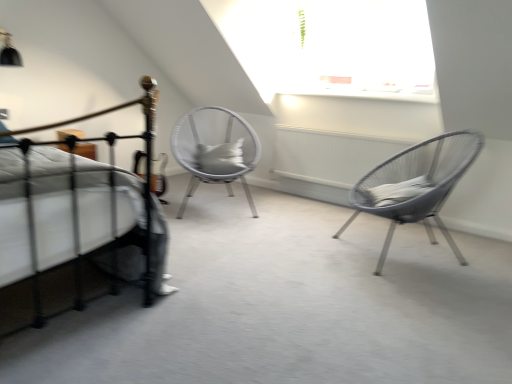
In order to face white woven chair at center, the 2th chair positioned from the right, should I rotate leftwards or rightwards?

To align with it, rotate left about 5.579°.

This screenshot has width=512, height=384. In order to click on gray fabric pillow at center in this screenshot , I will do `click(220, 158)`.

Find the location of a particular element. Image resolution: width=512 pixels, height=384 pixels. white woven chair at center, positioned as the first chair in left-to-right order is located at coordinates (213, 144).

Are black metal bed at left and gray fabric pillow at center making contact?

There is a gap between black metal bed at left and gray fabric pillow at center.

How distant is black metal bed at left from gray fabric pillow at center?

black metal bed at left is 1.47 meters away from gray fabric pillow at center.

Considering the positions of points (154, 223) and (232, 149), is point (154, 223) closer to camera compared to point (232, 149)?

Yes, point (154, 223) is closer to viewer.

Is gray fabric pillow at center not within white woven chair at center, acting as the 2th chair starting from the front?

No, gray fabric pillow at center is inside white woven chair at center, acting as the 2th chair starting from the front,'s boundary.

In the scene shown: Is the depth of gray fabric pillow at center greater than that of white woven chair at center, positioned as the first chair in left-to-right order?

That is True.

From a real-world perspective, which is physically above, gray fabric pillow at center or white woven chair at center, positioned as the first chair in left-to-right order?

From a 3D spatial view, gray fabric pillow at center is above.

Find the location of a particular element. This screenshot has width=512, height=384. pillow on the right of white woven chair at center, the 2th chair positioned from the right is located at coordinates (220, 158).

This screenshot has height=384, width=512. Identify the location of the 2nd chair counting from the right of the black metal bed at left. (416, 186).

Would you say metallic wire chair at right, the first chair in the front-to-back sequence, contains black metal bed at left?

No.

Is point (390, 162) positioned after point (75, 188)?

Yes, it is behind point (75, 188).

From the image's perspective, which object appears higher, metallic wire chair at right, the 2th chair in the back-to-front sequence, or black metal bed at left?

metallic wire chair at right, the 2th chair in the back-to-front sequence, from the image's perspective.

How different are the orientations of white woven chair at center, acting as the 2th chair starting from the front, and black metal bed at left in degrees?

37.5 degrees.

Starting from the black metal bed at left, which chair is the 1st one to the right? Please provide its 2D coordinates.

[(213, 144)]

Which is more to the left, white woven chair at center, positioned as the first chair in left-to-right order, or black metal bed at left?

From the viewer's perspective, black metal bed at left appears more on the left side.

Could you tell me if white woven chair at center, the 2th chair positioned from the right, is turned towards black metal bed at left?

No, white woven chair at center, the 2th chair positioned from the right, does not turn towards black metal bed at left.

Which object is wider, gray fabric pillow at center or black metal bed at left?

With larger width is black metal bed at left.

Which is correct: gray fabric pillow at center is inside black metal bed at left, or outside of it?

gray fabric pillow at center is outside black metal bed at left.

Which is nearer, (206,158) or (174,288)?

The point (174,288) is closer to the camera.

Who is smaller, white woven chair at center, acting as the 2th chair starting from the front, or gray fabric pillow at center?

gray fabric pillow at center is smaller.

Is white woven chair at center, positioned as the first chair in left-to-right order, aimed at gray fabric pillow at center?

Yes.

Is white woven chair at center, acting as the 2th chair starting from the front, inside or outside of gray fabric pillow at center?

white woven chair at center, acting as the 2th chair starting from the front, cannot be found inside gray fabric pillow at center.

In the scene shown: Looking at their sizes, would you say white woven chair at center, the 2th chair positioned from the right, is wider or thinner than gray fabric pillow at center?

In the image, white woven chair at center, the 2th chair positioned from the right, appears to be wider than gray fabric pillow at center.

Can you confirm if black metal bed at left is bigger than white woven chair at center, positioned as the first chair in left-to-right order?

Correct, black metal bed at left is larger in size than white woven chair at center, positioned as the first chair in left-to-right order.

Is black metal bed at left in front of or behind white woven chair at center, the first chair from the back, in the image?

black metal bed at left is positioned closer to the viewer than white woven chair at center, the first chair from the back.

How far apart are black metal bed at left and white woven chair at center, the 2th chair positioned from the right?

black metal bed at left and white woven chair at center, the 2th chair positioned from the right, are 5.02 feet apart.

From the image's perspective, is black metal bed at left under white woven chair at center, the 2th chair positioned from the right?

Yes.

Find the location of `bed lying below the gray fabric pillow at center (from the image's perspective)`. bed lying below the gray fabric pillow at center (from the image's perspective) is located at coordinates (78, 208).

The width and height of the screenshot is (512, 384). Identify the location of pillow lying above the white woven chair at center, the 2th chair positioned from the right (from the image's perspective). (220, 158).

Which object lies further to the anchor point black metal bed at left, white woven chair at center, acting as the 2th chair starting from the front, or metallic wire chair at right, the 2th chair in the back-to-front sequence?

The object further to black metal bed at left is metallic wire chair at right, the 2th chair in the back-to-front sequence.

Considering their positions, is black metal bed at left positioned further to gray fabric pillow at center than white woven chair at center, the 2th chair positioned from the right?

black metal bed at left is further to gray fabric pillow at center.

Considering their positions, is black metal bed at left positioned closer to metallic wire chair at right, the 2th chair in the back-to-front sequence, than white woven chair at center, the first chair from the back?

Based on the image, white woven chair at center, the first chair from the back, appears to be nearer to metallic wire chair at right, the 2th chair in the back-to-front sequence.

Based on their spatial positions, is white woven chair at center, the 2th chair positioned from the right, or black metal bed at left closer to gray fabric pillow at center?

white woven chair at center, the 2th chair positioned from the right, is positioned closer to the anchor gray fabric pillow at center.

When comparing their distances from metallic wire chair at right, arranged as the first chair when viewed from the right, does white woven chair at center, the first chair from the back, or black metal bed at left seem closer?

white woven chair at center, the first chair from the back, lies closer to metallic wire chair at right, arranged as the first chair when viewed from the right, than the other object.

When comparing their distances from white woven chair at center, positioned as the first chair in left-to-right order, does gray fabric pillow at center or black metal bed at left seem closer?

gray fabric pillow at center lies closer to white woven chair at center, positioned as the first chair in left-to-right order, than the other object.

Based on their spatial positions, is metallic wire chair at right, arranged as the first chair when viewed from the right, or white woven chair at center, positioned as the first chair in left-to-right order, closer to black metal bed at left?

white woven chair at center, positioned as the first chair in left-to-right order, lies closer to black metal bed at left than the other object.

From the image, which object appears to be farther from metallic wire chair at right, which is counted as the second chair, starting from the left, white woven chair at center, positioned as the first chair in left-to-right order, or gray fabric pillow at center?

white woven chair at center, positioned as the first chair in left-to-right order, is positioned further to the anchor metallic wire chair at right, which is counted as the second chair, starting from the left.

The image size is (512, 384). I want to click on pillow between black metal bed at left and metallic wire chair at right, the 2th chair in the back-to-front sequence, so click(220, 158).

Where is `pillow situated between white woven chair at center, positioned as the first chair in left-to-right order, and metallic wire chair at right, arranged as the first chair when viewed from the right, from left to right`? pillow situated between white woven chair at center, positioned as the first chair in left-to-right order, and metallic wire chair at right, arranged as the first chair when viewed from the right, from left to right is located at coordinates (220, 158).

You are a GUI agent. You are given a task and a screenshot of the screen. Output one action in this format:
    pyautogui.click(x=<x>, y=<y>)
    Task: Click on the chair between black metal bed at left and metallic wire chair at right, the first chair in the front-to-back sequence
    The image size is (512, 384).
    Given the screenshot: What is the action you would take?
    pyautogui.click(x=213, y=144)